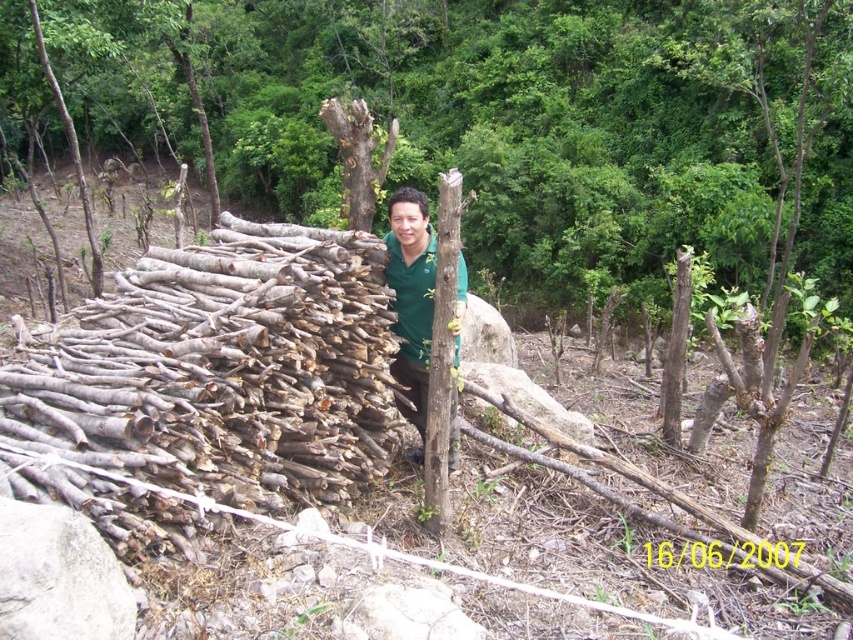
Between brown rough wood at center and bark textured tree at center, which one has more height?

Standing taller between the two is bark textured tree at center.

Looking at this image, can you confirm if brown rough wood at center is positioned to the right of bark textured tree at center?

No, brown rough wood at center is not to the right of bark textured tree at center.

Between point (309, 269) and point (778, 424), which one is positioned behind?

Positioned behind is point (778, 424).

This screenshot has height=640, width=853. I want to click on brown rough wood at center, so click(x=212, y=381).

Is brown rough wood at center above green matte shirt at center?

Indeed, brown rough wood at center is positioned over green matte shirt at center.

Is point (387, 451) more distant than point (404, 317)?

That is True.

Where is `brown rough wood at center`? The image size is (853, 640). brown rough wood at center is located at coordinates (212, 381).

Can you confirm if bark textured tree at center is shorter than green matte shirt at center?

No.

Is point (761, 467) in front of point (419, 358)?

Yes, it is.

Where is `bark textured tree at center`? The image size is (853, 640). bark textured tree at center is located at coordinates (772, 154).